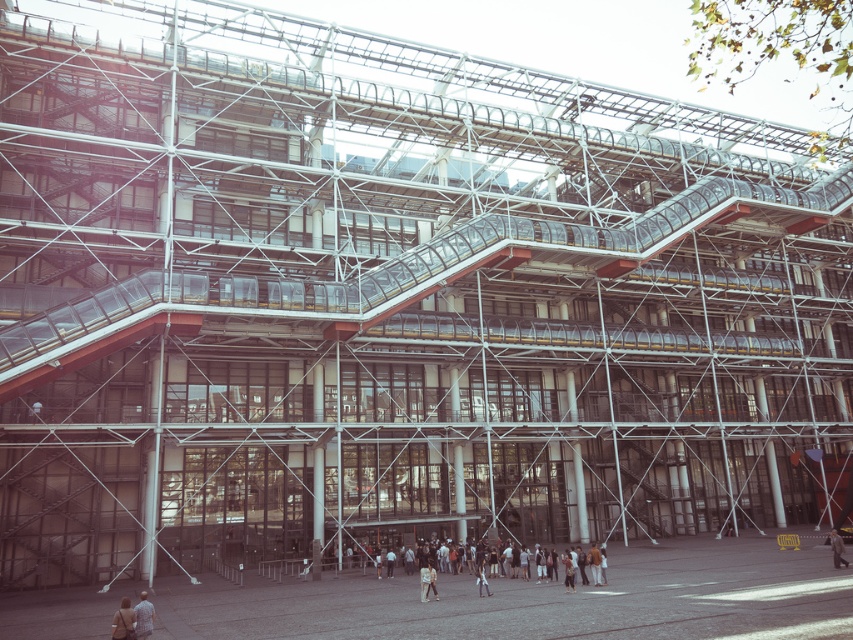
Question: Based on their relative distances, which object is nearer to the light brown leather jacket at center?

Choices:
 (A) plaid fabric shirt at lower left
 (B) light brown leather jacket at lower right

Answer: (B)

Question: Which point appears closest to the camera in this image?

Choices:
 (A) (137, 604)
 (B) (837, 545)
 (C) (424, 566)

Answer: (A)

Question: Can you confirm if light brown leather jacket at center is positioned below light brown leather jacket at lower right?

Choices:
 (A) yes
 (B) no

Answer: (A)

Question: Can you confirm if light brown leather jacket at center is bigger than light brown leather shoes at lower center?

Choices:
 (A) yes
 (B) no

Answer: (A)

Question: Is plaid fabric shirt at lower left behind light brown leather jacket at lower left?

Choices:
 (A) yes
 (B) no

Answer: (A)

Question: Among these points, which one is nearest to the camera?

Choices:
 (A) (437, 595)
 (B) (131, 609)
 (C) (479, 573)
 (D) (148, 634)

Answer: (B)